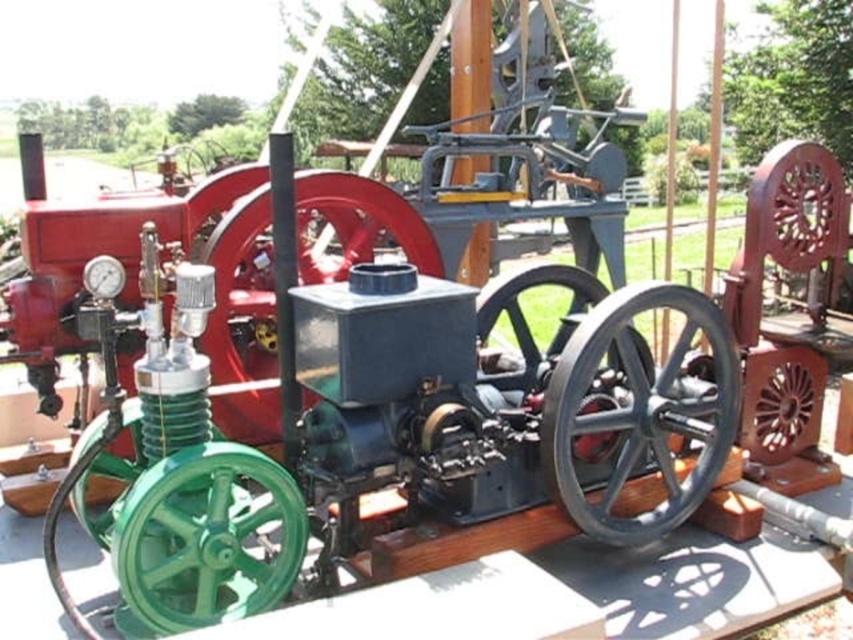
Consider the image. You are a museum guide explaining the machinery to visitors. You need to point out the height difference between the black metal wheel at center and the green polished wood wheel at lower left. Which one is taller?

The black metal wheel at center is taller than the green polished wood wheel at lower left.

In the scene shown: You are standing at the center of the vintage machinery display. There is a black metal wheel at center. Can you tell me what object is located exactly at the point with coordinates point [641,412]?

The black metal wheel at center is located exactly at the point with coordinates point [641,412].

You are a museum guide explaining the layout of the machinery to visitors. Pointing to the black metal wheel at center and the green polished wood wheel at lower left, you want to describe their spatial relationship. Which wheel is placed above the other?

The black metal wheel at center is positioned over the green polished wood wheel at lower left, meaning it is placed above the green polished wood wheel at lower left.